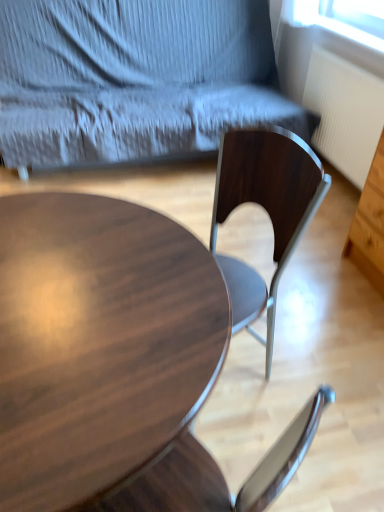
Question: Is wooden chair at center oriented towards white ribbed radiator at right?

Choices:
 (A) yes
 (B) no

Answer: (B)

Question: Can you confirm if wooden chair at center is smaller than white ribbed radiator at right?

Choices:
 (A) yes
 (B) no

Answer: (B)

Question: Is wooden chair at center not close to white ribbed radiator at right?

Choices:
 (A) yes
 (B) no

Answer: (B)

Question: Is wooden chair at center with white ribbed radiator at right?

Choices:
 (A) yes
 (B) no

Answer: (B)

Question: Is wooden chair at center thinner than white ribbed radiator at right?

Choices:
 (A) yes
 (B) no

Answer: (B)

Question: Does wooden chair at center have a greater width compared to white ribbed radiator at right?

Choices:
 (A) no
 (B) yes

Answer: (B)

Question: Can you confirm if shiny dark wood coffee table at center is wider than wooden chair at center?

Choices:
 (A) yes
 (B) no

Answer: (B)

Question: Does shiny dark wood coffee table at center have a lesser height compared to wooden chair at center?

Choices:
 (A) yes
 (B) no

Answer: (A)

Question: Is shiny dark wood coffee table at center directly adjacent to wooden chair at center?

Choices:
 (A) no
 (B) yes

Answer: (A)

Question: Does shiny dark wood coffee table at center appear on the left side of wooden chair at center?

Choices:
 (A) yes
 (B) no

Answer: (A)

Question: Considering the relative sizes of shiny dark wood coffee table at center and wooden chair at center in the image provided, is shiny dark wood coffee table at center smaller than wooden chair at center?

Choices:
 (A) yes
 (B) no

Answer: (A)

Question: Can you confirm if shiny dark wood coffee table at center is positioned to the right of wooden chair at center?

Choices:
 (A) yes
 (B) no

Answer: (B)

Question: Can you confirm if white ribbed radiator at right is taller than shiny dark wood coffee table at center?

Choices:
 (A) no
 (B) yes

Answer: (A)